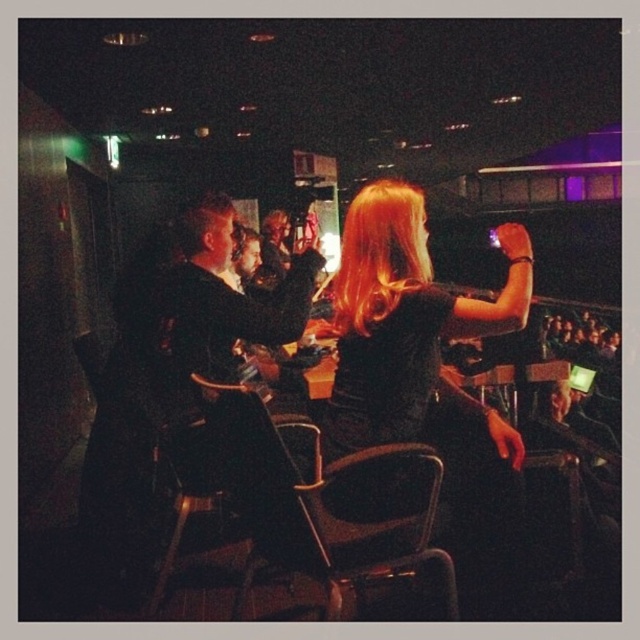
Who is more forward, (381,252) or (323,554)?

Point (323,554) is more forward.

Consider the image. Does black velvet dress at center have a greater height compared to black leather chair at center?

Correct, black velvet dress at center is much taller as black leather chair at center.

Between point (504, 292) and point (317, 492), which one is positioned behind?

The point (504, 292) is more distant.

The height and width of the screenshot is (640, 640). In order to click on black velvet dress at center in this screenshot , I will do `click(416, 339)`.